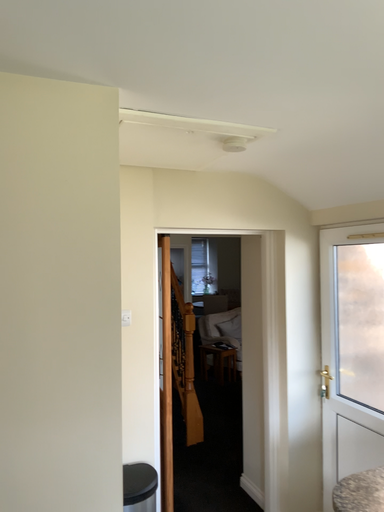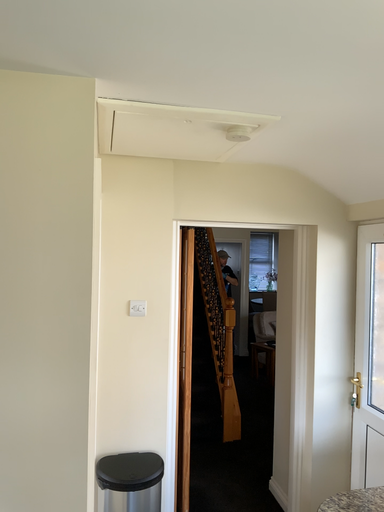
Question: Which way did the camera rotate in the video?

Choices:
 (A) rotated left
 (B) rotated right

Answer: (A)